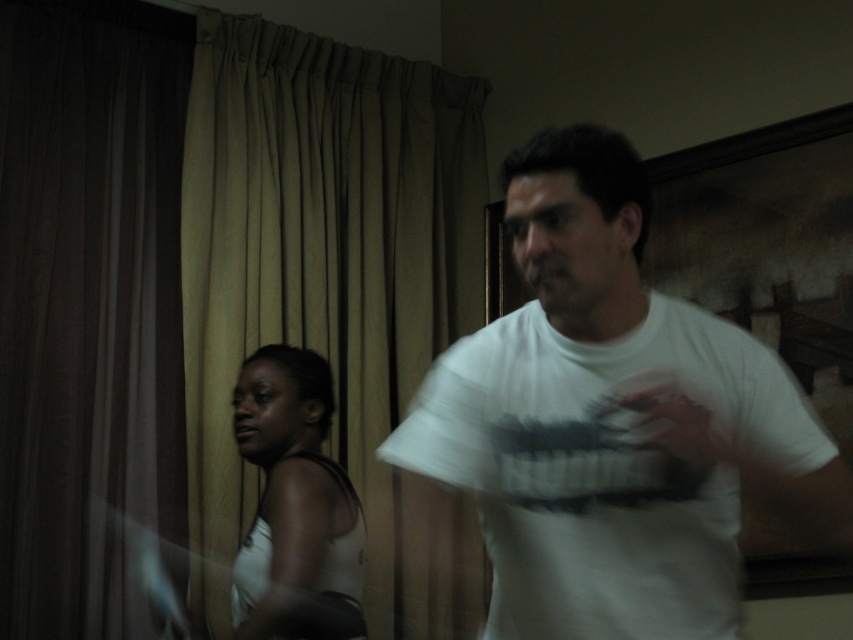
Question: Which point is farther to the camera?

Choices:
 (A) beige fabric curtain at upper center
 (B) white matte t-shirt at center
 (C) brown fabric curtain at left

Answer: (A)

Question: Which of these objects is positioned closest to the white matte t-shirt at center?

Choices:
 (A) beige fabric curtain at upper center
 (B) white matte tank top at left
 (C) brown fabric curtain at left

Answer: (B)

Question: Is beige fabric curtain at upper center closer to camera compared to white matte tank top at left?

Choices:
 (A) yes
 (B) no

Answer: (B)

Question: Among these points, which one is nearest to the camera?

Choices:
 (A) (171, 97)
 (B) (312, 522)
 (C) (370, 312)

Answer: (B)

Question: Is beige fabric curtain at upper center behind brown fabric curtain at left?

Choices:
 (A) yes
 (B) no

Answer: (A)

Question: Is white matte t-shirt at center thinner than brown fabric curtain at left?

Choices:
 (A) no
 (B) yes

Answer: (A)